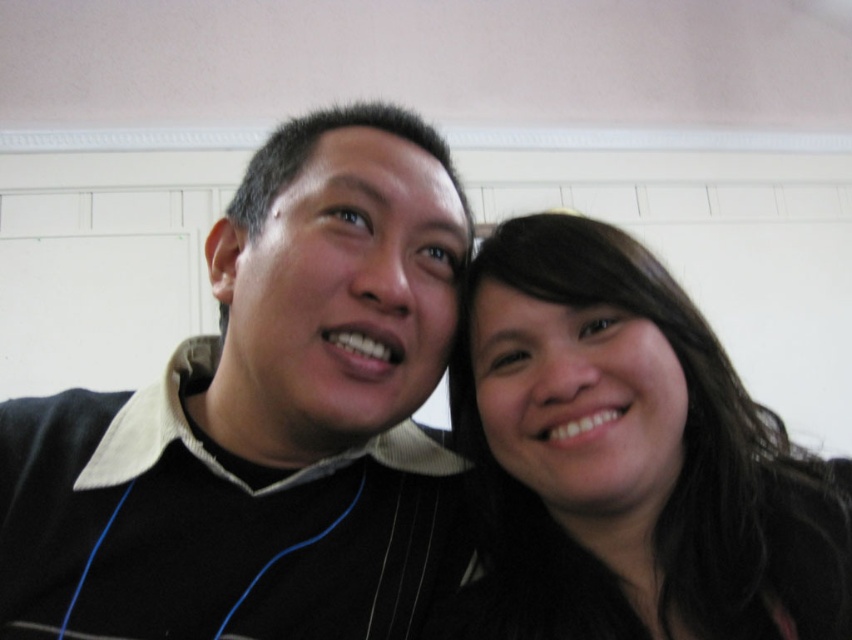
You are trying to take a photo of the black matte sweater at center but need to avoid the people in the image. Can you determine if the sweater is positioned between the two individuals or outside their combined space?

The black matte sweater at center is located at point (x=265, y=420), which is between the two individuals, so you cannot avoid them. You would need to ask them to move or take the photo from a different angle.

You are a photographer trying to adjust the lighting to highlight the black matte sweater at center and the dark brown hair at center. Since the sweater is covering part of the hair, which object should you focus the light on to ensure both are visible?

The black matte sweater at center is positioned over dark brown hair at center, so you should focus the light on the black matte sweater at center to ensure both are visible.